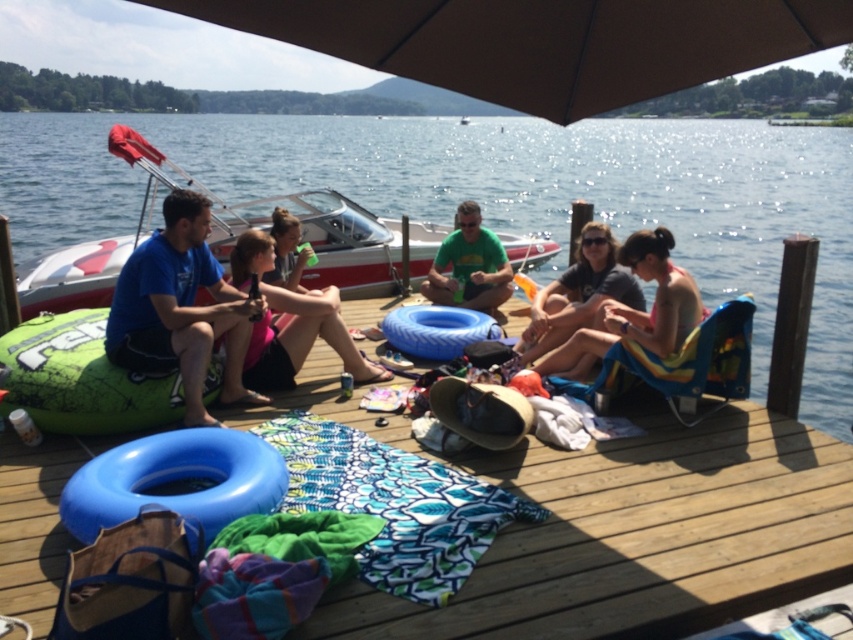
Question: Does blue rubber ring at center have a greater width compared to pink fabric at center?

Choices:
 (A) yes
 (B) no

Answer: (A)

Question: Can you confirm if pink fabric at right is smaller than matte pink shorts at center?

Choices:
 (A) no
 (B) yes

Answer: (A)

Question: Which object appears closest to the camera in this image?

Choices:
 (A) green matte shirt at center
 (B) blue rubber ring at center
 (C) matte pink shorts at center
 (D) green inflatable tube at left

Answer: (B)

Question: Which point appears closest to the camera in this image?

Choices:
 (A) (276, 227)
 (B) (494, 262)

Answer: (A)

Question: Can you confirm if pink fabric at center is positioned to the left of matte pink shorts at center?

Choices:
 (A) yes
 (B) no

Answer: (B)

Question: Estimate the real-world distances between objects in this image. Which object is closer to the pink fabric at right?

Choices:
 (A) green matte shirt at center
 (B) wooden deck at center
 (C) pink fabric at center

Answer: (B)